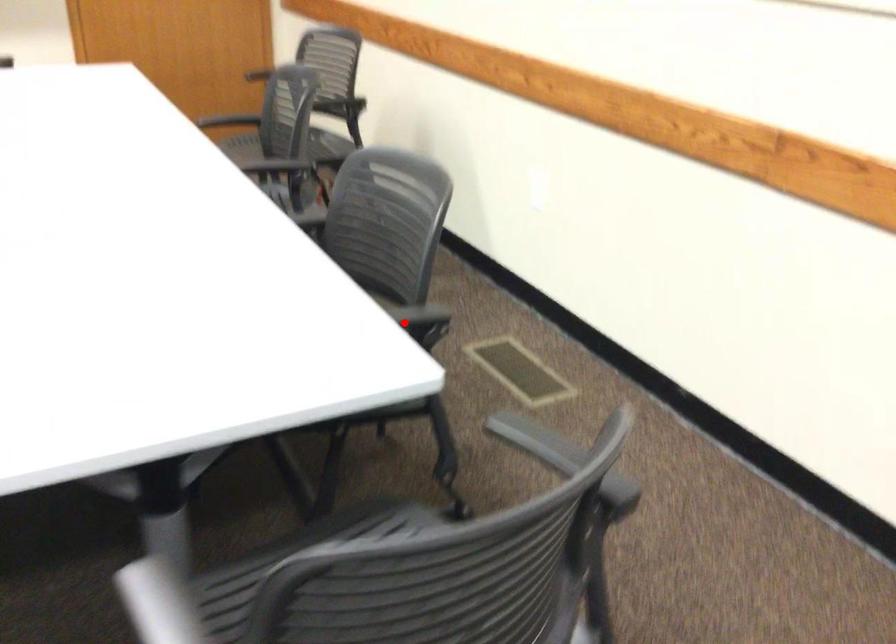
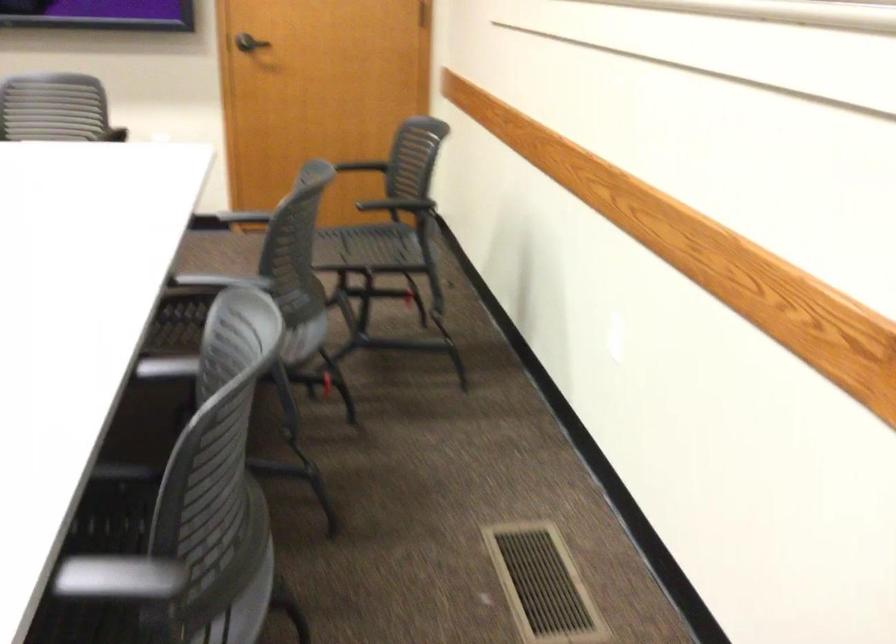
The point at the highlighted location is marked in the first image. Where is the corresponding point in the second image?

(118, 578)